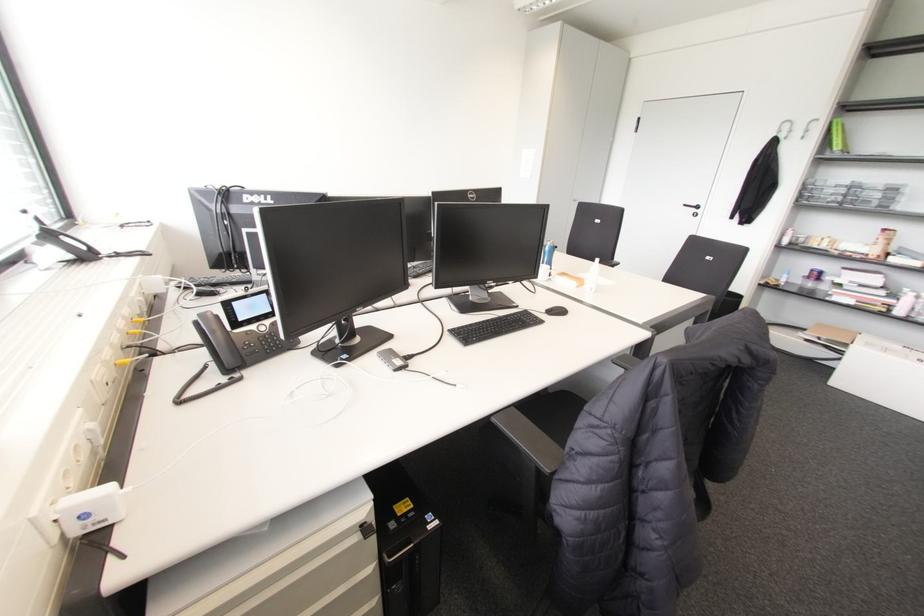
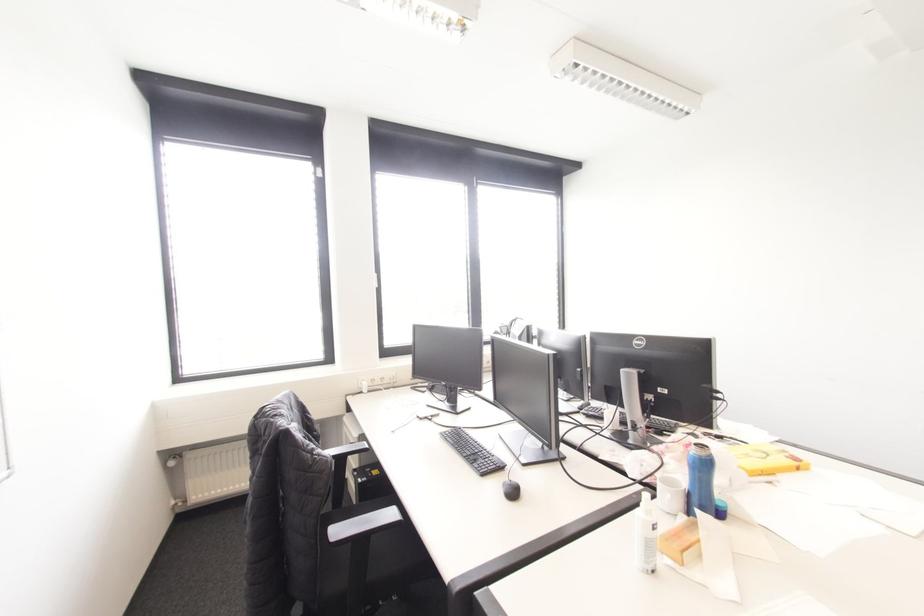
The point at (476, 323) is marked in the first image. Where is the corresponding point in the second image?

(468, 436)